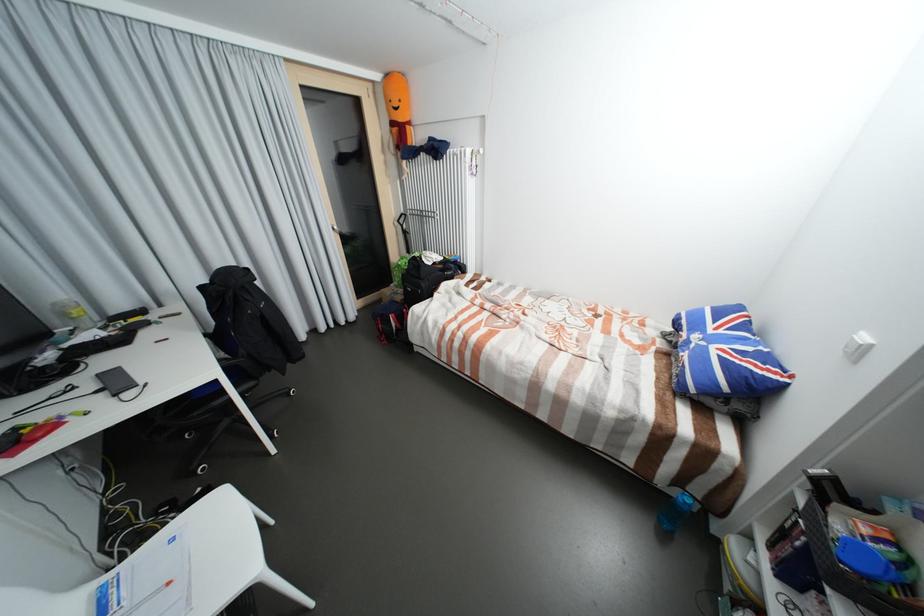
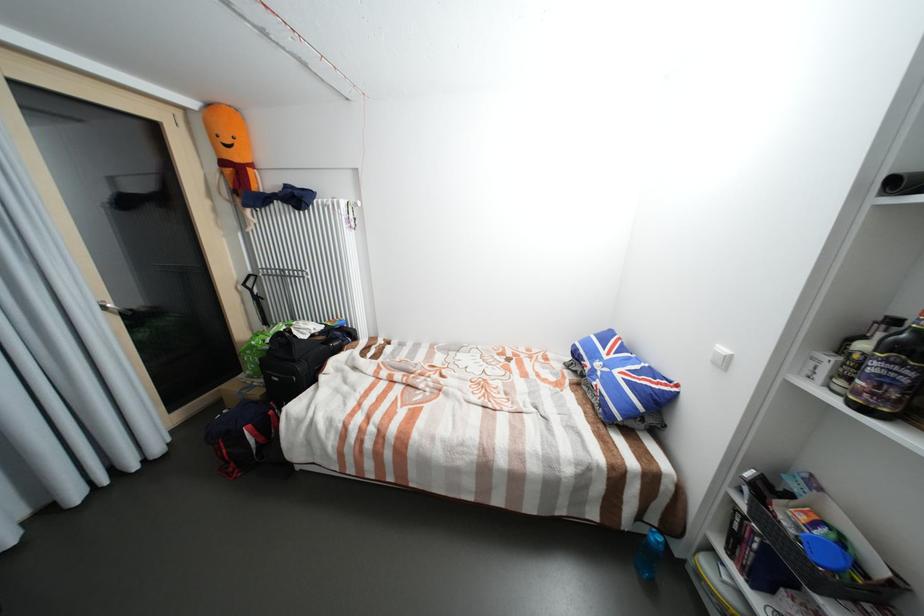
The point at (399, 124) is marked in the first image. Where is the corresponding point in the second image?

(229, 163)